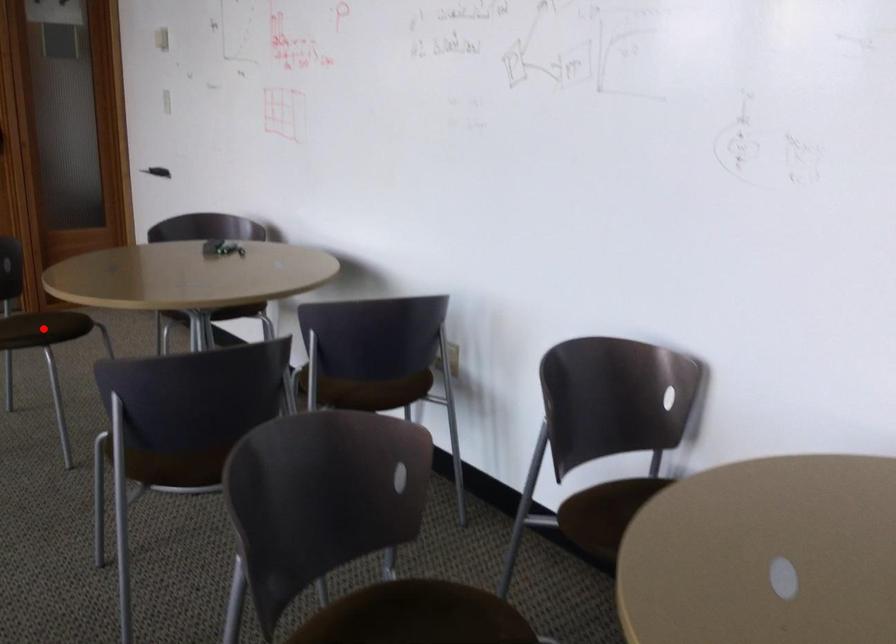
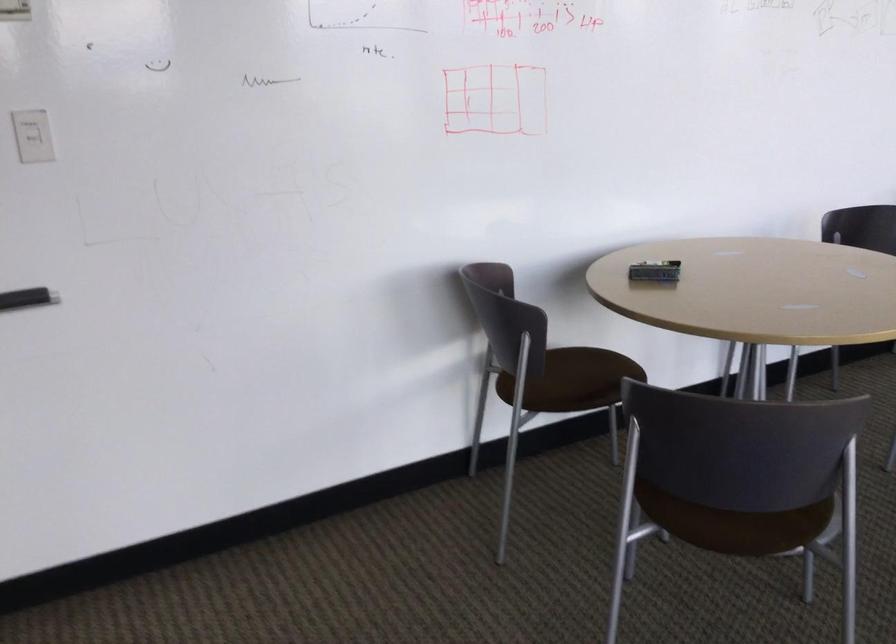
Question: I am providing you with two images of the same scene from different viewpoints. A red point is marked on the first image. At the location where the point appears in image 1, is it still visible in image 2?

Choices:
 (A) Yes
 (B) No

Answer: (B)